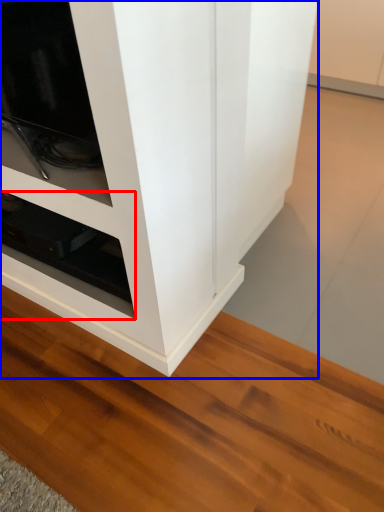
Question: Which point is further to the camera, shelf (highlighted by a red box) or cupboard (highlighted by a blue box)?

Choices:
 (A) shelf
 (B) cupboard

Answer: (A)